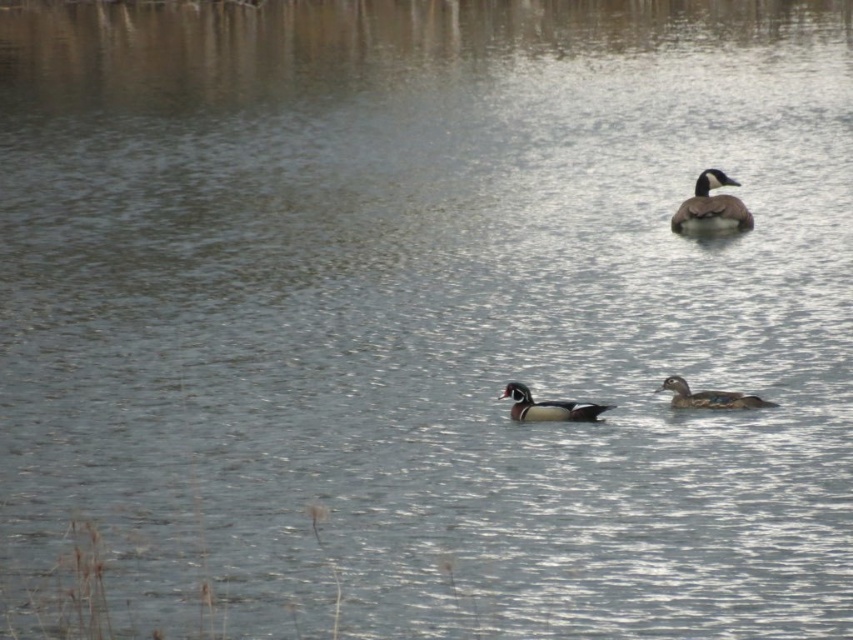
Question: Is shiny brown duck at center below multicolored glossy wood duck at center?

Choices:
 (A) no
 (B) yes

Answer: (B)

Question: Which object appears farthest from the camera in this image?

Choices:
 (A) multicolored glossy wood duck at center
 (B) shiny brown duck at center

Answer: (A)

Question: Is shiny brown duck at center behind multicolored glossy wood duck at center?

Choices:
 (A) yes
 (B) no

Answer: (B)

Question: Which of the following is the closest to the observer?

Choices:
 (A) (587, 404)
 (B) (712, 220)

Answer: (A)

Question: Which object is farther from the camera taking this photo?

Choices:
 (A) multicolored glossy wood duck at center
 (B) shiny brown duck at center

Answer: (A)

Question: Does brown speckled duck at upper right have a lesser width compared to shiny brown duck at center?

Choices:
 (A) yes
 (B) no

Answer: (B)